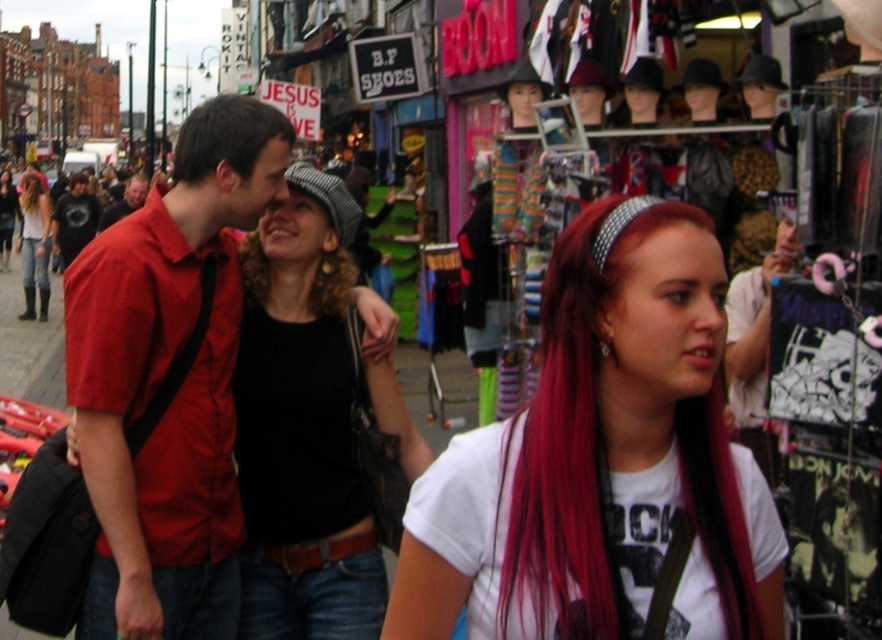
Looking at this image, who is positioned more to the right, brown matte hair at upper left or leather boots at left?

Positioned to the right is brown matte hair at upper left.

What do you see at coordinates (226, 136) in the screenshot? The image size is (882, 640). I see `brown matte hair at upper left` at bounding box center [226, 136].

Identify the location of brown matte hair at upper left. The image size is (882, 640). (226, 136).

Where is `brown matte hair at upper left`? brown matte hair at upper left is located at coordinates (226, 136).

Who is positioned more to the right, shiny red hair at center or curly brown hair at center?

shiny red hair at center

Where is `shiny red hair at center`? The width and height of the screenshot is (882, 640). shiny red hair at center is located at coordinates (603, 461).

Where is `shiny red hair at center`? The height and width of the screenshot is (640, 882). shiny red hair at center is located at coordinates (603, 461).

The height and width of the screenshot is (640, 882). What are the coordinates of `shiny red hair at center` in the screenshot? It's located at (603, 461).

Does shiny red hair at center have a lesser width compared to blonde hair at center?

No.

Is shiny red hair at center wider than blonde hair at center?

Yes, shiny red hair at center is wider than blonde hair at center.

Is point (503, 576) more distant than point (35, 195)?

No, (503, 576) is closer to viewer.

Find the location of a particular element. This screenshot has width=882, height=640. shiny red hair at center is located at coordinates (603, 461).